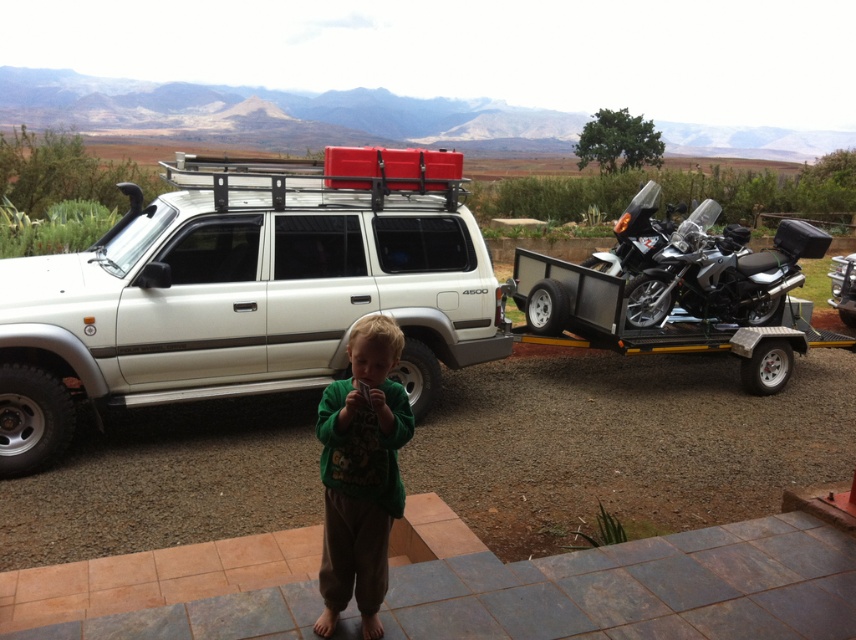
Question: Is white matte suv at center further to camera compared to black textured motorcycle at right?

Choices:
 (A) no
 (B) yes

Answer: (A)

Question: In this image, where is white matte suv at center located relative to black textured motorcycle at right?

Choices:
 (A) left
 (B) right

Answer: (A)

Question: Estimate the real-world distances between objects in this image. Which object is farther from the green fuzzy sweater at center?

Choices:
 (A) metallic silver motorcycle at right
 (B) black textured motorcycle at right

Answer: (A)

Question: Among these objects, which one is farthest from the camera?

Choices:
 (A) black textured motorcycle at right
 (B) metallic silver motorcycle at right
 (C) green fuzzy sweater at center
 (D) white matte suv at center

Answer: (B)

Question: Estimate the real-world distances between objects in this image. Which object is closer to the metallic silver motorcycle at right?

Choices:
 (A) white matte suv at center
 (B) black textured motorcycle at right
 (C) green fuzzy sweater at center

Answer: (B)

Question: Is black textured motorcycle at right smaller than metallic silver motorcycle at right?

Choices:
 (A) no
 (B) yes

Answer: (A)